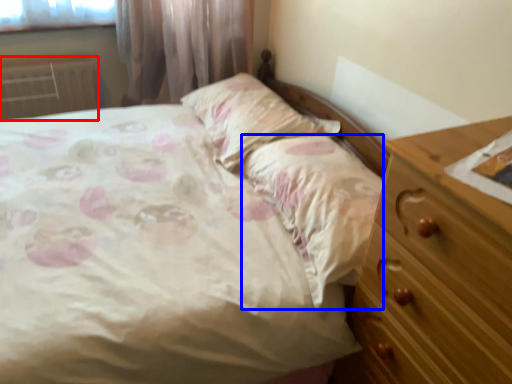
Question: Which point is closer to the camera, radiator (highlighted by a red box) or sheet (highlighted by a blue box)?

Choices:
 (A) radiator
 (B) sheet

Answer: (B)